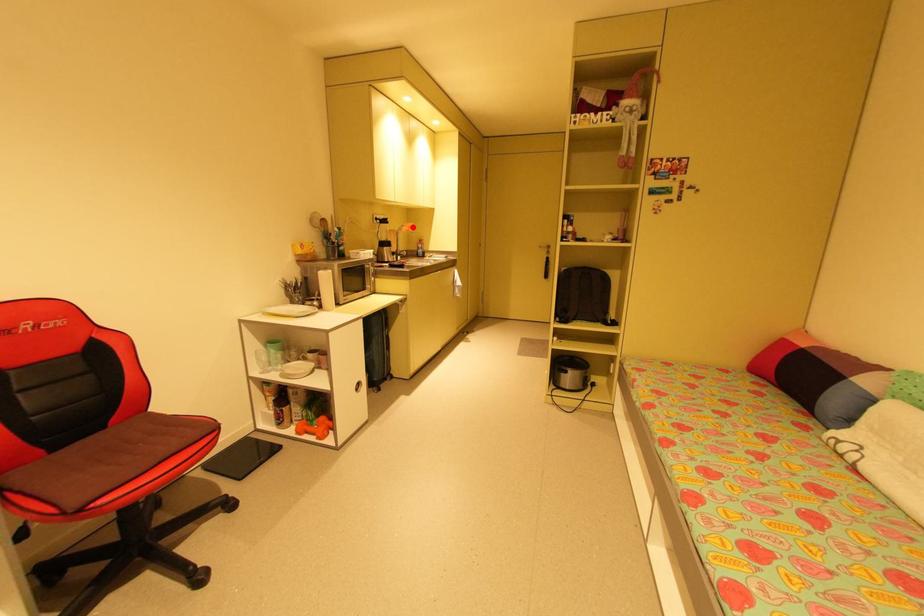
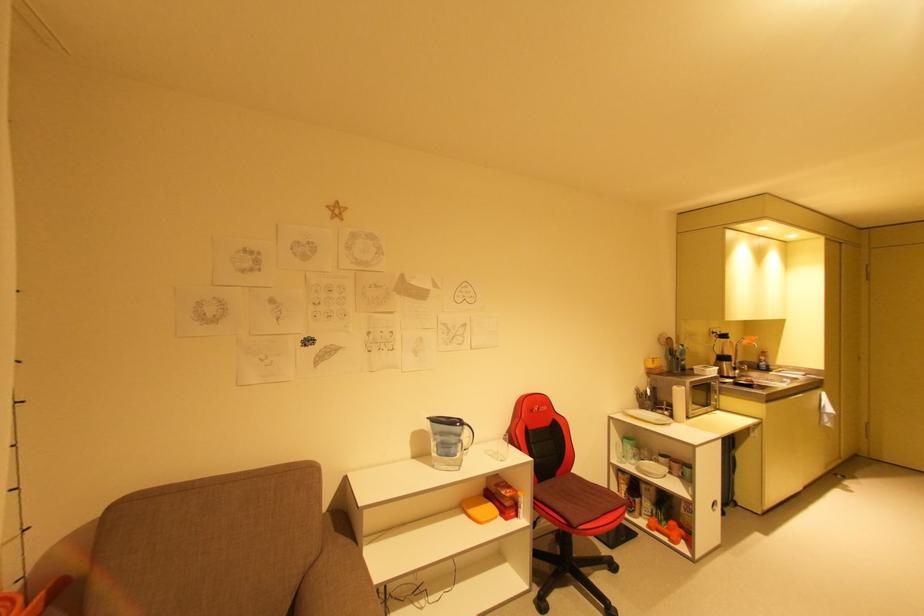
Question: I am providing you with two images of the same scene from different viewpoints. Given a red point in image1, look at the same physical point in image2. Is it:

Choices:
 (A) Closer to the viewpoint
 (B) Farther from the viewpoint

Answer: (B)